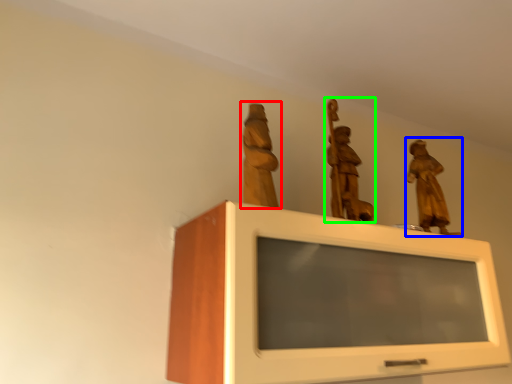
Question: Considering the real-world distances, which object is closest to sculpture (highlighted by a red box)? sculpture (highlighted by a blue box) or sculpture (highlighted by a green box).

Choices:
 (A) sculpture
 (B) sculpture

Answer: (B)